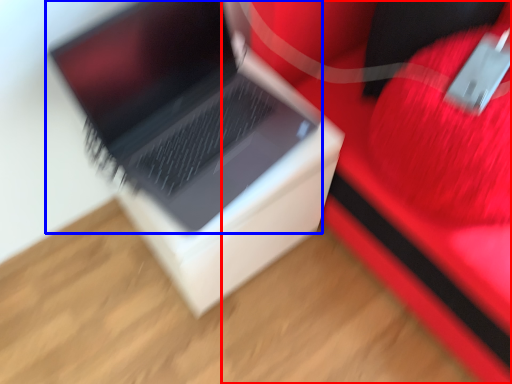
Question: Which object is closer to the camera taking this photo, furniture (highlighted by a red box) or laptop (highlighted by a blue box)?

Choices:
 (A) furniture
 (B) laptop

Answer: (A)